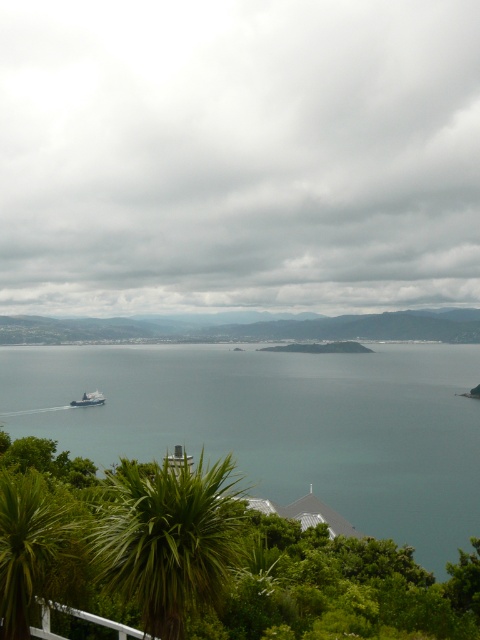
Question: Which object is the closest to the blue metallic cruise ship at lower left?

Choices:
 (A) green leafy palm tree at lower center
 (B) blue water at center

Answer: (B)

Question: Is green leafy palm tree at lower center to the right of green leafy palm tree at lower left from the viewer's perspective?

Choices:
 (A) no
 (B) yes

Answer: (B)

Question: Is green leafy palm tree at lower center further to the viewer compared to blue metallic cruise ship at lower left?

Choices:
 (A) yes
 (B) no

Answer: (B)

Question: Among these points, which one is farthest from the camera?

Choices:
 (A) (100, 394)
 (B) (340, 449)
 (C) (227, 483)
 (D) (47, 545)

Answer: (A)

Question: Among these points, which one is nearest to the camera?

Choices:
 (A) (118, 481)
 (B) (24, 572)
 (C) (85, 403)
 (D) (275, 492)

Answer: (B)

Question: In this image, where is green leafy palm tree at lower left located relative to blue metallic cruise ship at lower left?

Choices:
 (A) left
 (B) right

Answer: (B)